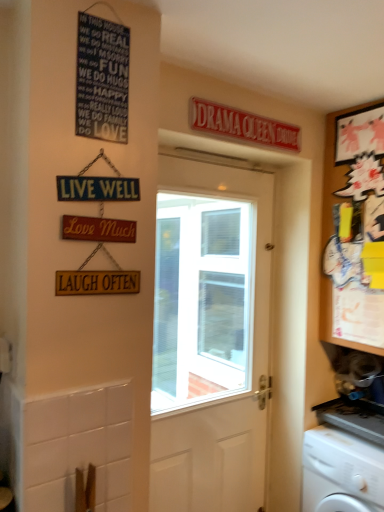
Question: Looking at the image, does white wooden door at center seem bigger or smaller compared to white plastic washing machine at lower right?

Choices:
 (A) big
 (B) small

Answer: (B)

Question: Is point (241, 245) positioned closer to the camera than point (344, 495)?

Choices:
 (A) closer
 (B) farther

Answer: (B)

Question: Considering the real-world distances, which object is closest to the white plastic washing machine at lower right?

Choices:
 (A) wooden cabinet at right
 (B) white wooden door at center
 (C) red plastic sign at upper center
 (D) matte black signboard at upper left
 (E) wooden signboard at center-left

Answer: (A)

Question: Which object is positioned closest to the white wooden door at center?

Choices:
 (A) wooden cabinet at right
 (B) matte black signboard at upper left
 (C) red plastic sign at upper center
 (D) wooden signboard at center-left
 (E) white plastic washing machine at lower right

Answer: (E)